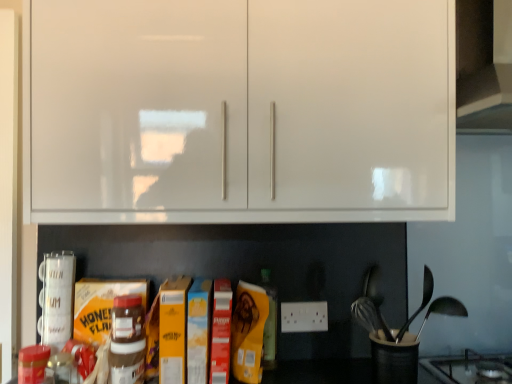
Question: Does black plastic utensil holder at lower right have a larger size compared to black glass gas stove at lower right?

Choices:
 (A) yes
 (B) no

Answer: (B)

Question: Would you say black plastic utensil holder at lower right is a long distance from black glass gas stove at lower right?

Choices:
 (A) yes
 (B) no

Answer: (B)

Question: Are black plastic utensil holder at lower right and black glass gas stove at lower right beside each other?

Choices:
 (A) no
 (B) yes

Answer: (A)

Question: Is black glass gas stove at lower right surrounded by black plastic utensil holder at lower right?

Choices:
 (A) no
 (B) yes

Answer: (A)

Question: Is black plastic utensil holder at lower right positioned before black glass gas stove at lower right?

Choices:
 (A) no
 (B) yes

Answer: (A)

Question: Is black plastic utensil holder at lower right facing towards black glass gas stove at lower right?

Choices:
 (A) no
 (B) yes

Answer: (A)

Question: Is white glossy cabinet at upper center oriented away from black glass gas stove at lower right?

Choices:
 (A) no
 (B) yes

Answer: (A)

Question: Does white glossy cabinet at upper center come in front of black glass gas stove at lower right?

Choices:
 (A) no
 (B) yes

Answer: (B)

Question: From the image's perspective, does white glossy cabinet at upper center appear lower than black glass gas stove at lower right?

Choices:
 (A) yes
 (B) no

Answer: (B)

Question: Does white glossy cabinet at upper center have a greater width compared to black glass gas stove at lower right?

Choices:
 (A) yes
 (B) no

Answer: (B)

Question: Is the depth of white glossy cabinet at upper center greater than that of black glass gas stove at lower right?

Choices:
 (A) no
 (B) yes

Answer: (A)

Question: Is white glossy cabinet at upper center not within black glass gas stove at lower right?

Choices:
 (A) yes
 (B) no

Answer: (A)

Question: From the image's perspective, is matte brown plastic nutella jar at center, the second bottle positioned from the right, on top of black plastic utensil holder at lower right?

Choices:
 (A) no
 (B) yes

Answer: (B)